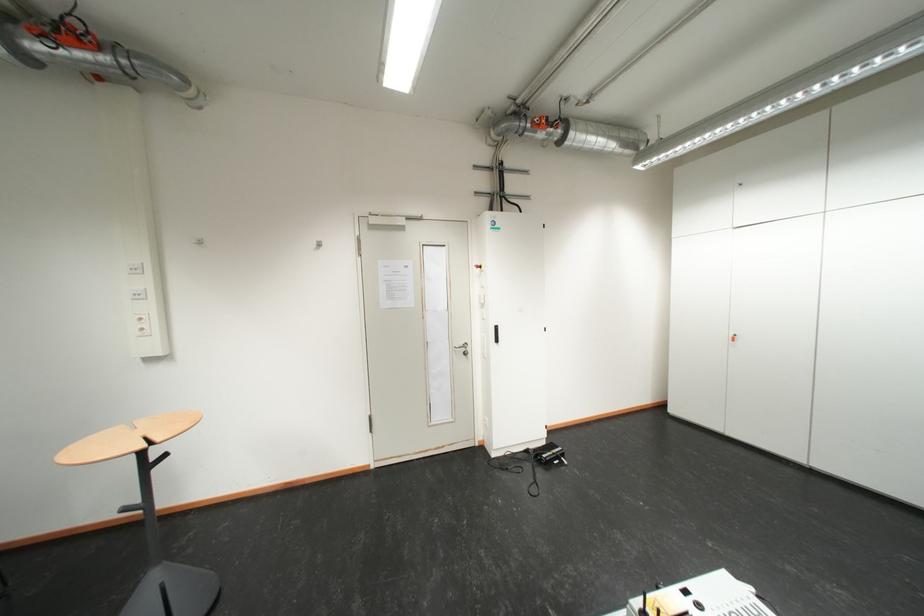
Describe the element at coordinates (503, 334) in the screenshot. The image size is (924, 616). I see `the black cabinet handle` at that location.